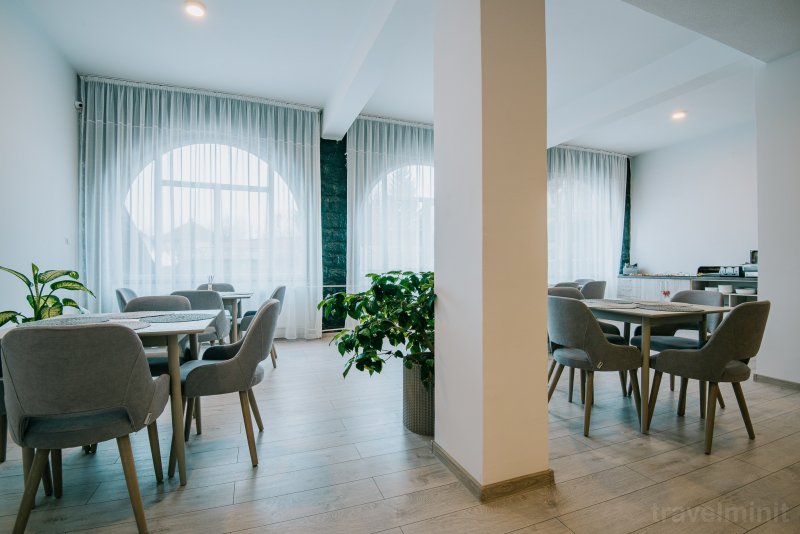
The height and width of the screenshot is (534, 800). Identify the location of plate. (729, 286), (728, 290), (729, 295), (713, 287), (721, 289), (722, 292), (745, 292), (750, 292).